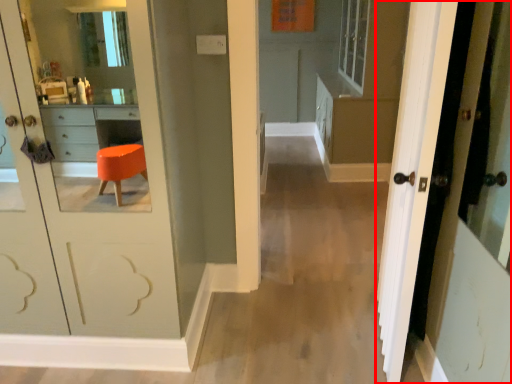
Question: From the image's perspective, where is door (annotated by the red box) located relative to dresser?

Choices:
 (A) below
 (B) above

Answer: (A)